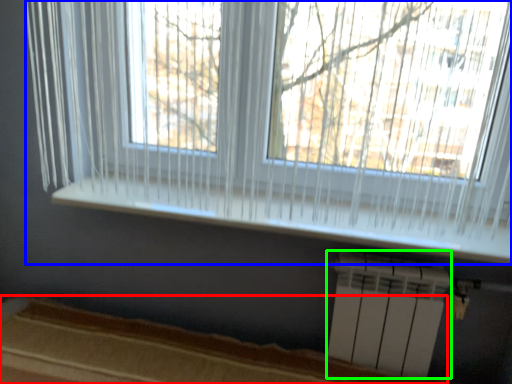
Question: Estimate the real-world distances between objects in this image. Which object is farther from bed frame (highlighted by a red box), window (highlighted by a blue box) or air conditioning (highlighted by a green box)?

Choices:
 (A) window
 (B) air conditioning

Answer: (A)